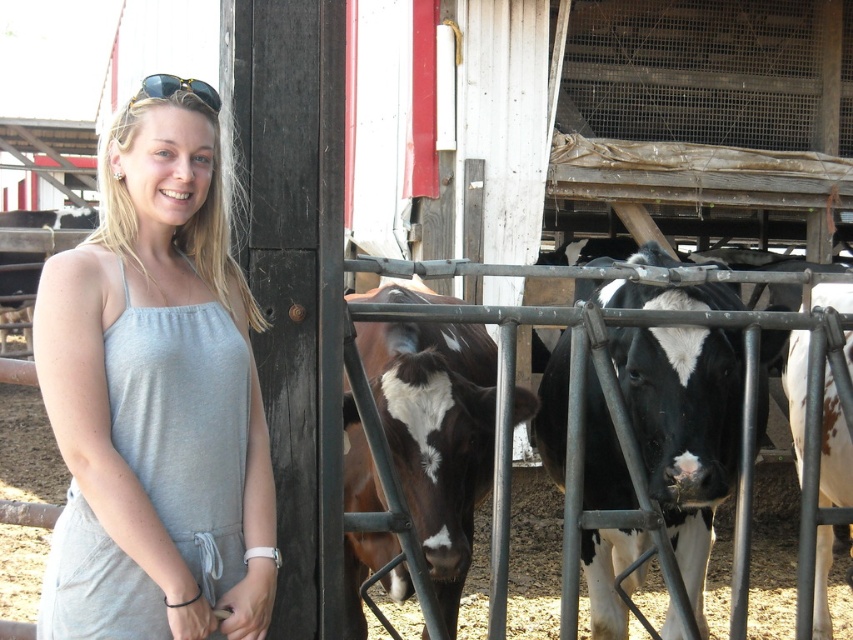
Between brown glossy cow at center and gold metallic sunglasses at upper left, which one appears on the left side from the viewer's perspective?

gold metallic sunglasses at upper left is more to the left.

Can you confirm if brown glossy cow at center is wider than gold metallic sunglasses at upper left?

Indeed, brown glossy cow at center has a greater width compared to gold metallic sunglasses at upper left.

This screenshot has height=640, width=853. What do you see at coordinates (436, 435) in the screenshot?
I see `brown glossy cow at center` at bounding box center [436, 435].

This screenshot has height=640, width=853. Find the location of `brown glossy cow at center`. brown glossy cow at center is located at coordinates (436, 435).

Identify the location of black and white fur at center. (683, 429).

Measure the distance from black and white fur at center to gold metallic sunglasses at upper left.

1.96 meters

Find the location of `black and white fur at center`. black and white fur at center is located at coordinates (683, 429).

What are the coordinates of `black and white fur at center` in the screenshot? It's located at point(683,429).

Which is behind, point (163, 365) or point (430, 570)?

Point (430, 570)

Is point (146, 556) closer to camera compared to point (405, 444)?

That is True.

Identify the location of gray fabric dress at center. (155, 401).

You are a GUI agent. You are given a task and a screenshot of the screen. Output one action in this format:
    pyautogui.click(x=<x>, y=<y>)
    Task: Click on the gray fabric dress at center
    The width and height of the screenshot is (853, 640).
    Given the screenshot: What is the action you would take?
    pyautogui.click(x=155, y=401)